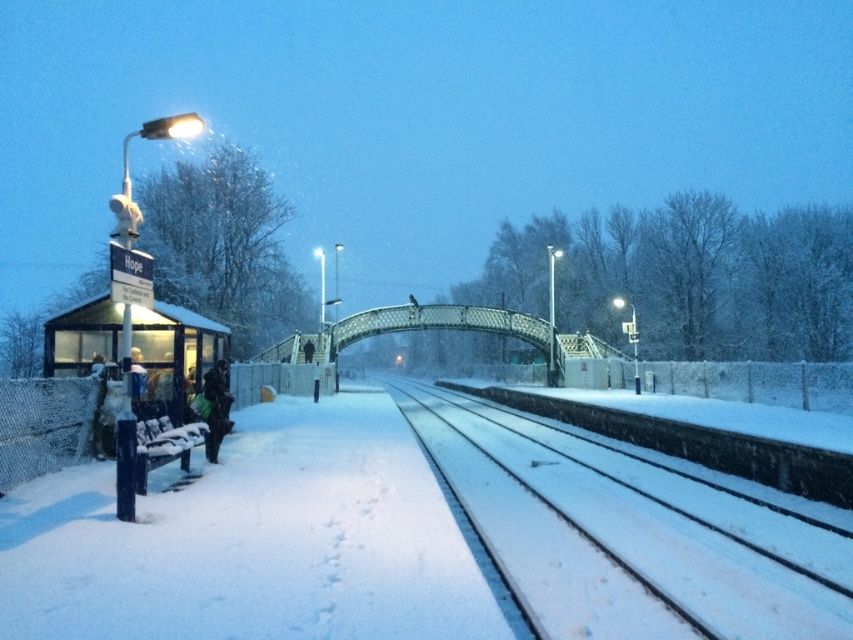
Consider the image. You are standing at the shelter labeled Hope in the winter scene. You notice two points marked on the ground. One is at coordinate point (781, 532) and the other is at point (215, 371). Which point is closer to you?

Point (781, 532) is closer to the viewer than point (215, 371).